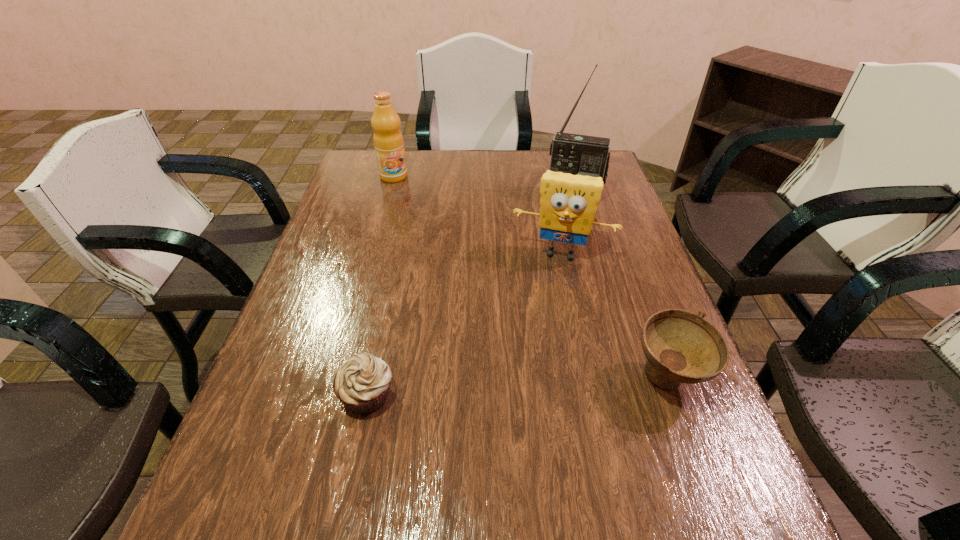
This screenshot has height=540, width=960. What are the coordinates of `vacant space located 0.250m on the display of the second farthest object` in the screenshot? It's located at (555, 253).

You are a GUI agent. You are given a task and a screenshot of the screen. Output one action in this format:
    pyautogui.click(x=<x>, y=<y>)
    Task: Click on the vacant region located on the display of the second farthest object
    The height and width of the screenshot is (540, 960).
    Given the screenshot: What is the action you would take?
    pyautogui.click(x=549, y=274)

The height and width of the screenshot is (540, 960). What are the coordinates of `vacant area located on the display of the second farthest object` in the screenshot? It's located at (564, 216).

You are a GUI agent. You are given a task and a screenshot of the screen. Output one action in this format:
    pyautogui.click(x=<x>, y=<y>)
    Task: Click on the vacant region located on the front label of the fourth shortest object
    Image resolution: width=960 pixels, height=540 pixels.
    Given the screenshot: What is the action you would take?
    pyautogui.click(x=421, y=248)

Identify the location of vacant region located on the front label of the fourth shortest object. (408, 213).

Identify the location of vacant area situated on the front label of the fourth shortest object. The height and width of the screenshot is (540, 960). (399, 191).

This screenshot has width=960, height=540. I want to click on free space located 0.250m on the face of the third shortest object, so click(x=533, y=338).

Identify the location of vacant space positioned 0.340m on the face of the third shortest object. (525, 370).

Locate an element on the screen. vacant space located on the face of the third shortest object is located at coordinates (532, 341).

Find the location of a particular element. The width and height of the screenshot is (960, 540). object that is at the far edge is located at coordinates (388, 141).